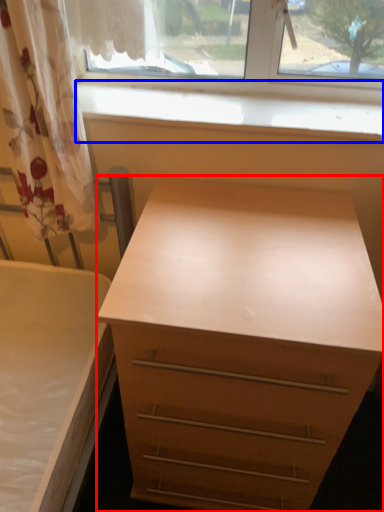
Question: Among these objects, which one is farthest to the camera, chest of drawers (highlighted by a red box) or window sill (highlighted by a blue box)?

Choices:
 (A) chest of drawers
 (B) window sill

Answer: (B)